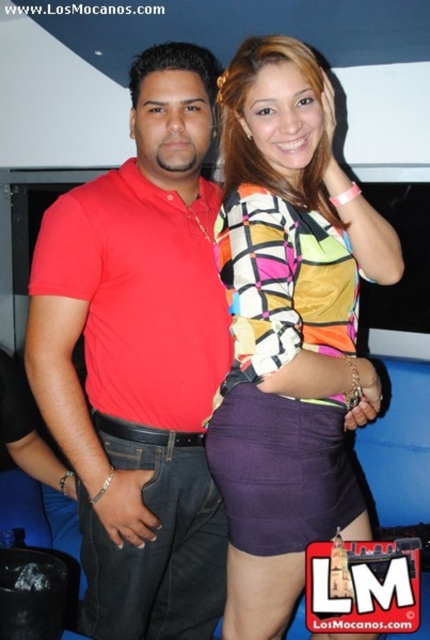
Question: Can you confirm if matte red polo shirt at center is wider than purple satin skirt at center?

Choices:
 (A) no
 (B) yes

Answer: (B)

Question: Which of the following is the farthest from the observer?

Choices:
 (A) (113, 605)
 (B) (334, 240)

Answer: (A)

Question: Can you confirm if matte red polo shirt at center is thinner than purple satin skirt at center?

Choices:
 (A) no
 (B) yes

Answer: (A)

Question: Which of the following is the farthest from the observer?

Choices:
 (A) matte red polo shirt at center
 (B) purple satin skirt at center

Answer: (A)

Question: Observing the image, what is the correct spatial positioning of matte red polo shirt at center in reference to purple satin skirt at center?

Choices:
 (A) above
 (B) below

Answer: (B)